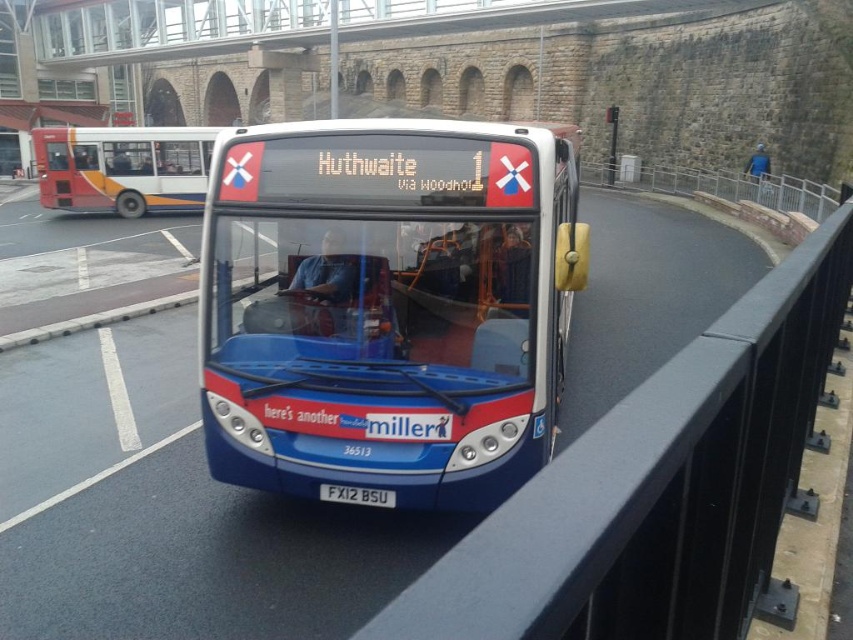
You are a passenger on the bus and want to take a photo of the metal at center and the white metallic license plate at center. Which one is positioned to the right side of the other?

The metal at center is to the right of the white metallic license plate at center.

You are a bus driver who needs to check the license plate for a toll booth ahead. Since the metal at center is wider than the white metallic license plate at center, which object would block your view of the license plate more when looking from the driver seat?

The metal at center would block the view of the white metallic license plate at center more because it is wider.

You are a pedestrian standing on the bridge looking at the bus. Which object is closer to the bridge railing, the blue metallic bus at center or the white metallic license plate at center?

The blue metallic bus at center is closer to the bridge railing because it is positioned to the right of the white metallic license plate at center, which would place it nearer to the railing if the railing is on the right side of the bridge.